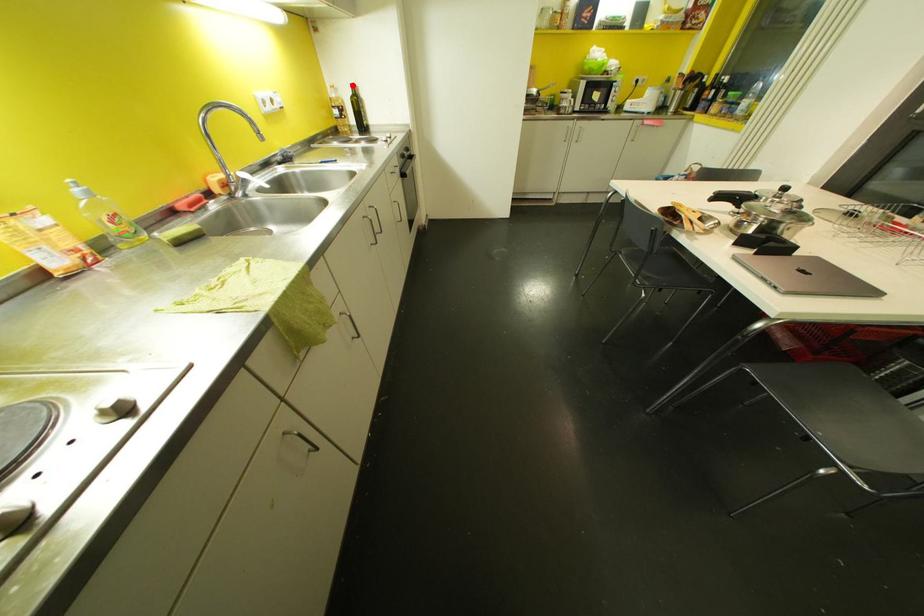
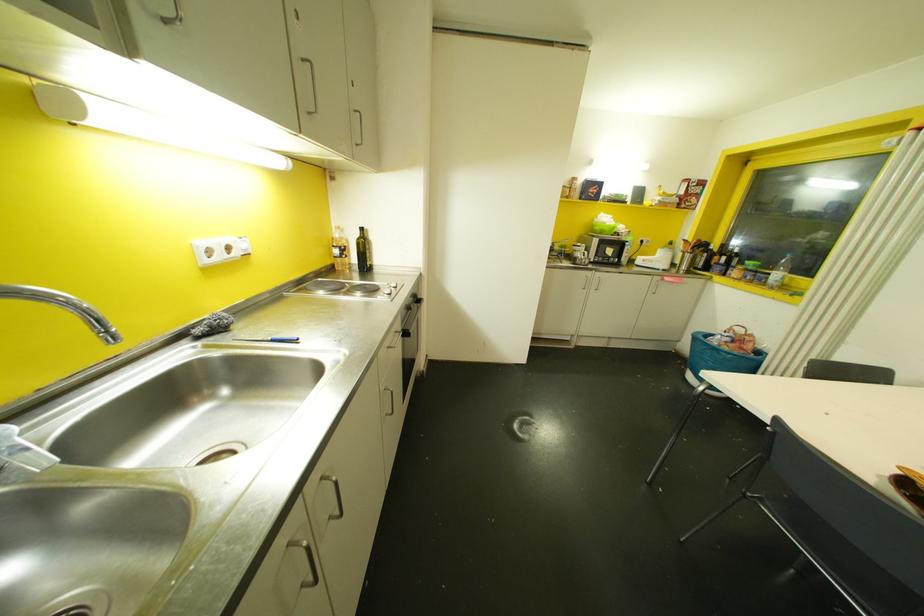
The point at the highlighted location is marked in the first image. Where is the corresponding point in the second image?

(360, 229)